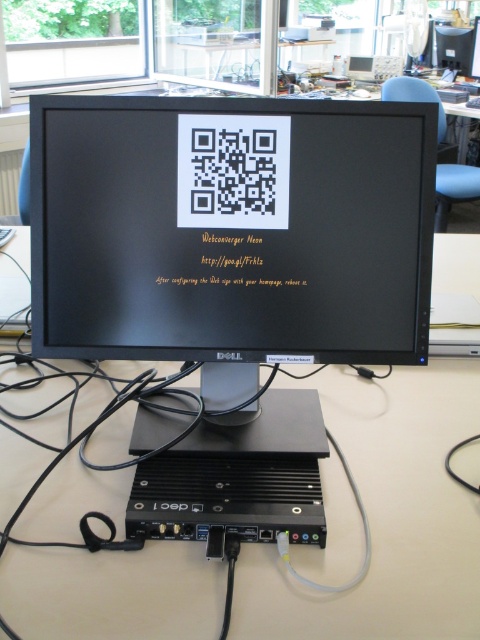
Is point (144, 307) closer to viewer compared to point (368, 403)?

Yes, point (144, 307) is closer to viewer.

At what (x,y) coordinates should I click in order to perform the action: click on black glossy monitor at center. Please return your answer as a coordinate pair (x, y). The height and width of the screenshot is (640, 480). Looking at the image, I should click on [x=230, y=232].

Who is lower down, black glossy monitor at center or black plastic computer at lower center?

black plastic computer at lower center is lower down.

Can you confirm if black glossy monitor at center is positioned above black plastic computer at lower center?

Correct, black glossy monitor at center is located above black plastic computer at lower center.

What do you see at coordinates (230, 232) in the screenshot? I see `black glossy monitor at center` at bounding box center [230, 232].

The height and width of the screenshot is (640, 480). I want to click on black glossy monitor at center, so click(230, 232).

Can you confirm if beige plastic table at center is bigger than black plastic computer at lower center?

Indeed, beige plastic table at center has a larger size compared to black plastic computer at lower center.

Does beige plastic table at center appear on the right side of black plastic computer at lower center?

No, beige plastic table at center is not to the right of black plastic computer at lower center.

Describe the element at coordinates (385, 513) in the screenshot. I see `beige plastic table at center` at that location.

Identify the location of beige plastic table at center. click(385, 513).